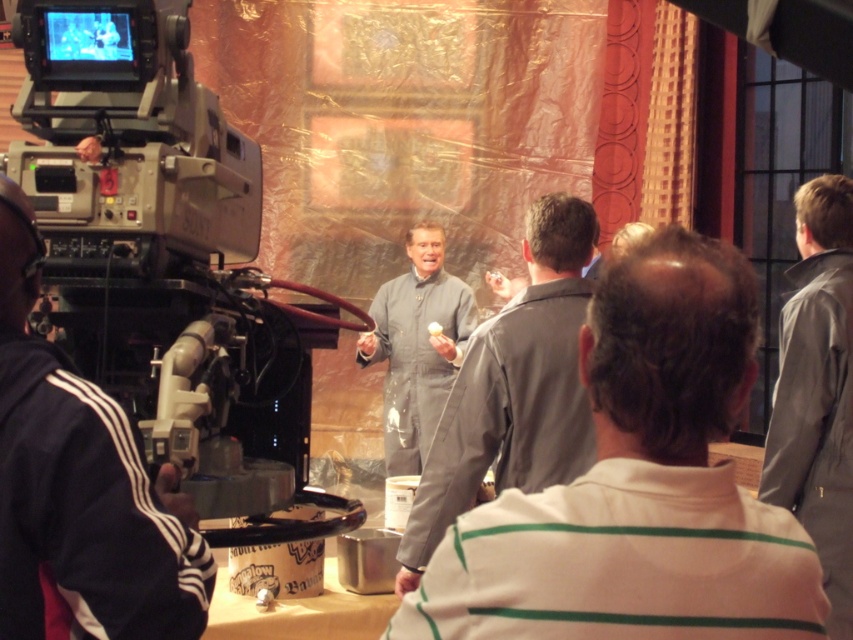
You are a costume designer observing the set. You need to determine which garment is shorter between the gray fabric suit at center and the gray leather jacket at right. Which one is shorter?

The gray fabric suit at center is shorter than the gray leather jacket at right.

You are a costume designer working on a TV show and need to find the gray fabric suit at center. According to the coordinates provided, where should you look on the screen?

The gray fabric suit at center is located at point coordinates (637,484).